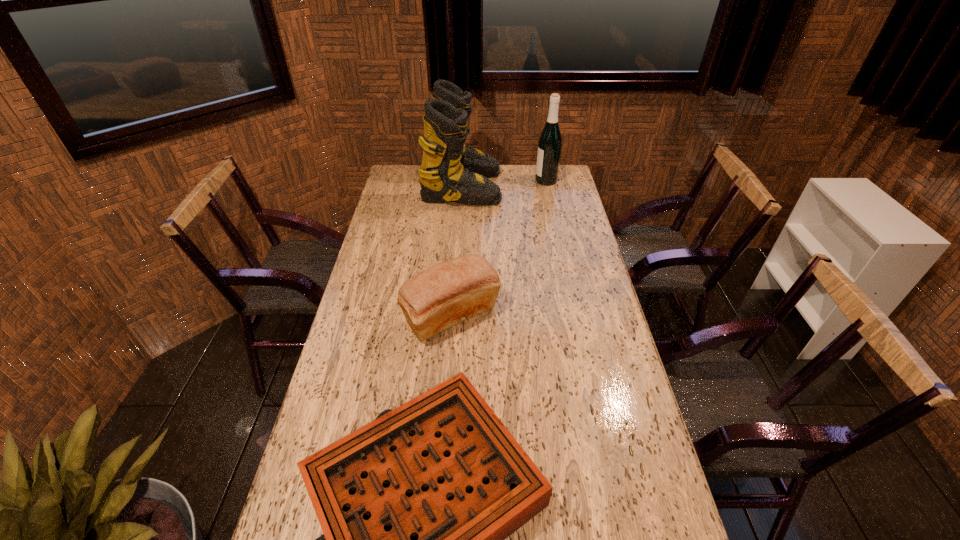
Identify the location of vacant space that's between the wine bottle and the third farthest object. This screenshot has width=960, height=540. (499, 248).

At what (x,y) coordinates should I click in order to perform the action: click on object that is the closest one to the shortest object. Please return your answer as a coordinate pair (x, y). The height and width of the screenshot is (540, 960). Looking at the image, I should click on (444, 295).

Identify which object is the third nearest to the gameboard. Please provide its 2D coordinates. Your answer should be formatted as a tuple, i.e. [(x, y)], where the tuple contains the x and y coordinates of a point satisfying the conditions above.

[(550, 141)]

The width and height of the screenshot is (960, 540). What are the coordinates of `vacant position in the image that satisfies the following two spatial constraints: 1. on the back side of the bread; 2. on the left side of the ski boots` in the screenshot? It's located at pyautogui.click(x=460, y=187).

Find the location of `free space that satisfies the following two spatial constraints: 1. on the label of the wine bottle; 2. on the front side of the ski boots`. free space that satisfies the following two spatial constraints: 1. on the label of the wine bottle; 2. on the front side of the ski boots is located at coordinates (547, 187).